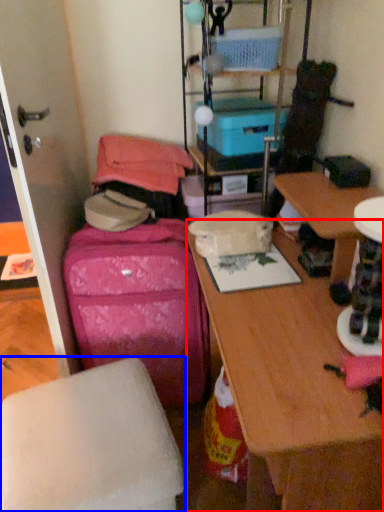
Question: Among these objects, which one is farthest to the camera, desk (highlighted by a red box) or furniture (highlighted by a blue box)?

Choices:
 (A) desk
 (B) furniture

Answer: (B)